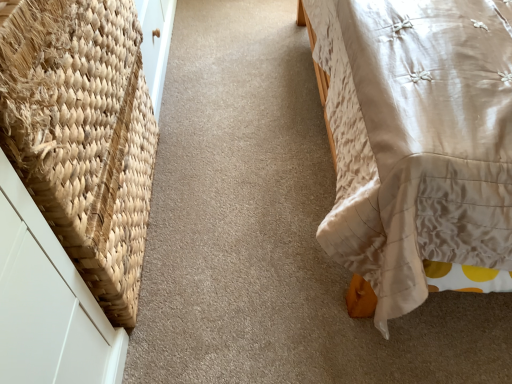
Image resolution: width=512 pixels, height=384 pixels. What do you see at coordinates (83, 135) in the screenshot? I see `natural woven basket at left` at bounding box center [83, 135].

Locate an element on the screen. The image size is (512, 384). natural woven basket at left is located at coordinates (83, 135).

Image resolution: width=512 pixels, height=384 pixels. I want to click on white satin bed at right, so click(416, 138).

The image size is (512, 384). What do you see at coordinates (416, 138) in the screenshot?
I see `white satin bed at right` at bounding box center [416, 138].

Image resolution: width=512 pixels, height=384 pixels. Identify the location of natural woven basket at left. (83, 135).

Based on the photo, can you confirm if white satin bed at right is positioned to the right of natural woven basket at left?

Correct, you'll find white satin bed at right to the right of natural woven basket at left.

Based on the photo, considering the positions of objects white satin bed at right and natural woven basket at left in the image provided, who is behind, white satin bed at right or natural woven basket at left?

Positioned behind is natural woven basket at left.

Is point (486, 210) positioned in front of point (144, 83)?

Yes, it is in front of point (144, 83).

From the image's perspective, which object appears higher, white satin bed at right or natural woven basket at left?

white satin bed at right is shown above in the image.

From a real-world perspective, which is physically below, white satin bed at right or natural woven basket at left?

natural woven basket at left.

Does white satin bed at right have a lesser width compared to natural woven basket at left?

In fact, white satin bed at right might be wider than natural woven basket at left.

Does white satin bed at right have a lesser height compared to natural woven basket at left?

No, white satin bed at right is not shorter than natural woven basket at left.

Is white satin bed at right smaller than natural woven basket at left?

Actually, white satin bed at right might be larger than natural woven basket at left.

Is white satin bed at right surrounding natural woven basket at left?

No, natural woven basket at left is not surrounded by white satin bed at right.

Are white satin bed at right and natural woven basket at left far apart?

white satin bed at right is actually quite close to natural woven basket at left.

Is white satin bed at right positioned with its back to natural woven basket at left?

No, white satin bed at right's orientation is not away from natural woven basket at left.

Where is `furniture above the natural woven basket at left (from a real-world perspective)`? The height and width of the screenshot is (384, 512). furniture above the natural woven basket at left (from a real-world perspective) is located at coordinates (416, 138).

Is natural woven basket at left to the left of white satin bed at right from the viewer's perspective?

Yes.

Relative to white satin bed at right, is natural woven basket at left in front or behind?

Clearly, natural woven basket at left is behind white satin bed at right.

Does point (10, 144) come farther from viewer compared to point (346, 210)?

No, it is not.

Based on the photo, from the image's perspective, is natural woven basket at left on white satin bed at right?

No, from the image's perspective, natural woven basket at left is not on top of white satin bed at right.

From a real-world perspective, is natural woven basket at left positioned above or below white satin bed at right?

From a real-world perspective, natural woven basket at left is physically below white satin bed at right.

Consider the image. Between natural woven basket at left and white satin bed at right, which one has larger width?

With larger width is white satin bed at right.

Is natural woven basket at left shorter than white satin bed at right?

Indeed, natural woven basket at left has a lesser height compared to white satin bed at right.

Between natural woven basket at left and white satin bed at right, which one has larger size?

Bigger between the two is white satin bed at right.

Is white satin bed at right a part of natural woven basket at left?

No, white satin bed at right is not surrounded by natural woven basket at left.

Are natural woven basket at left and white satin bed at right far apart?

natural woven basket at left is actually quite close to white satin bed at right.

Is natural woven basket at left oriented towards white satin bed at right?

Yes.

From the picture: What's the angular difference between natural woven basket at left and white satin bed at right's facing directions?

There is a 179-degree angle between the facing directions of natural woven basket at left and white satin bed at right.

Identify the location of basket beneath the white satin bed at right (from a real-world perspective). The width and height of the screenshot is (512, 384). (83, 135).

You are a GUI agent. You are given a task and a screenshot of the screen. Output one action in this format:
    pyautogui.click(x=<x>, y=<y>)
    Task: Click on the furniture in front of the natural woven basket at left
    The image size is (512, 384).
    Given the screenshot: What is the action you would take?
    pyautogui.click(x=416, y=138)

The image size is (512, 384). In order to click on basket lying on the left of white satin bed at right in this screenshot , I will do `click(83, 135)`.